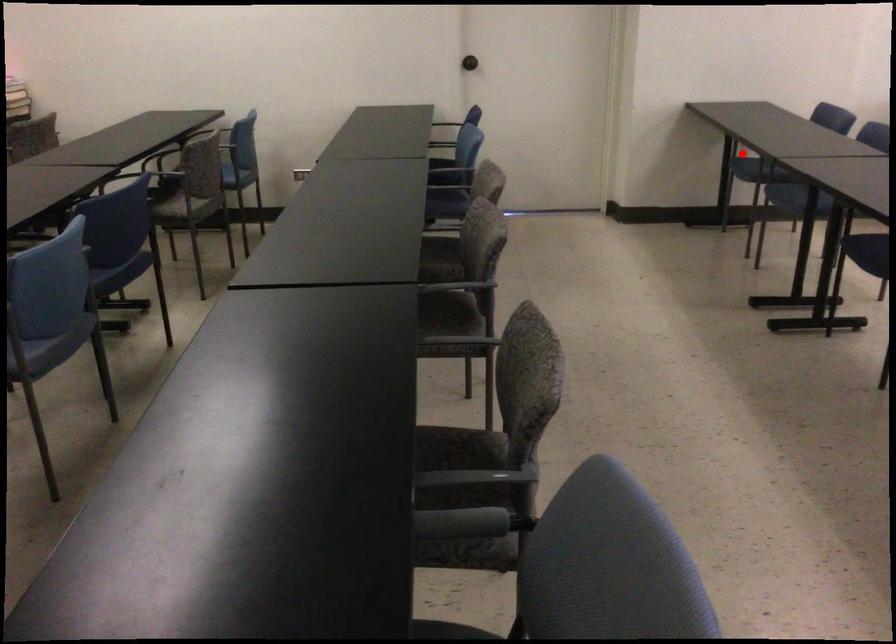
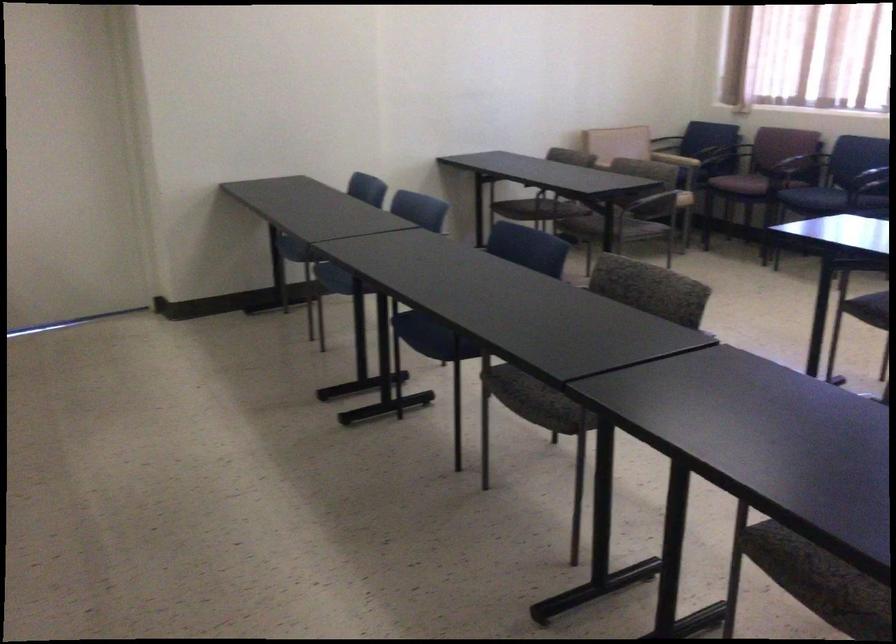
Question: A red point is marked in image1. In image2, is the corresponding 3D point closer to the camera or farther? Reply with the corresponding letter.

Choices:
 (A) The corresponding 3D point is closer.
 (B) The corresponding 3D point is farther.

Answer: (A)